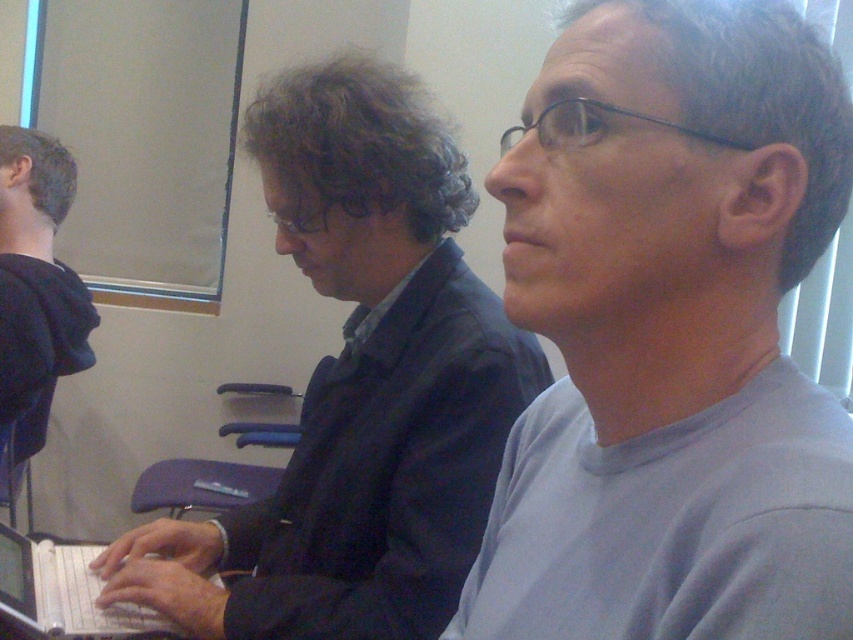
Question: Can you confirm if gray matte shirt at center is positioned to the left of dark blue hoodie at left?

Choices:
 (A) yes
 (B) no

Answer: (B)

Question: Is gray matte shirt at center bigger than dark blue hoodie at left?

Choices:
 (A) no
 (B) yes

Answer: (A)

Question: Which of the following is the closest to the observer?

Choices:
 (A) dark blue suit at center
 (B) white plastic laptop at center
 (C) dark blue hoodie at left

Answer: (A)

Question: Among these objects, which one is nearest to the camera?

Choices:
 (A) dark blue hoodie at left
 (B) white plastic laptop at center

Answer: (B)

Question: Does dark blue suit at center have a greater width compared to white plastic laptop at center?

Choices:
 (A) yes
 (B) no

Answer: (A)

Question: Among these objects, which one is nearest to the camera?

Choices:
 (A) dark blue suit at center
 (B) dark blue hoodie at left
 (C) gray matte shirt at center
 (D) white plastic laptop at center

Answer: (C)